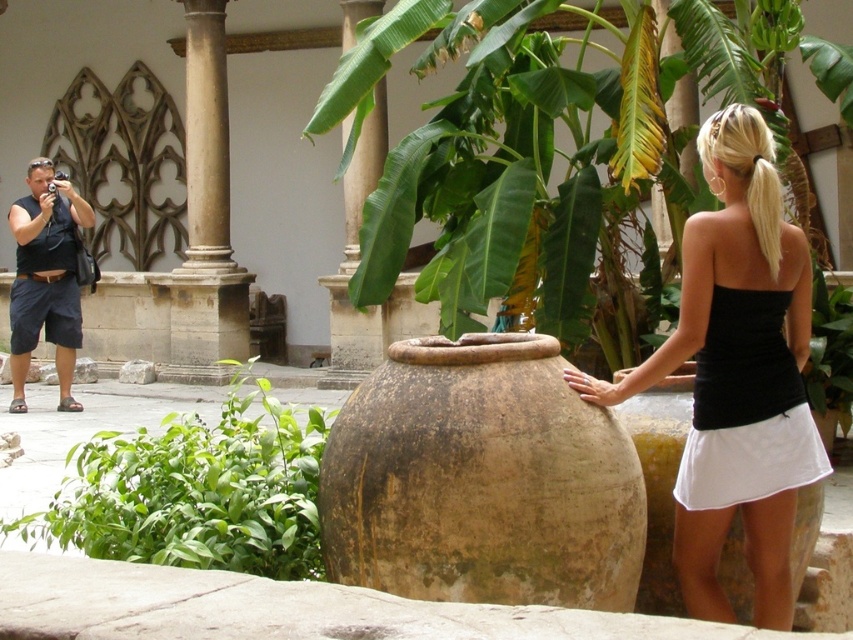
Is point (570, 512) more distant than point (315, 508)?

No.

Describe the element at coordinates (480, 481) in the screenshot. I see `brown earthenware vase at center` at that location.

Is point (322, 465) positioned before point (151, 531)?

That is True.

You are a GUI agent. You are given a task and a screenshot of the screen. Output one action in this format:
    pyautogui.click(x=<x>, y=<y>)
    Task: Click on the brown earthenware vase at center
    Image resolution: width=853 pixels, height=640 pixels.
    Given the screenshot: What is the action you would take?
    pyautogui.click(x=480, y=481)

Who is higher up, black matte tank top at center or green leafy plant at left?

Positioned higher is black matte tank top at center.

Can you confirm if black matte tank top at center is smaller than green leafy plant at left?

No, black matte tank top at center is not smaller than green leafy plant at left.

Image resolution: width=853 pixels, height=640 pixels. I want to click on black matte tank top at center, so click(737, 374).

Find the location of a particular element. black matte tank top at center is located at coordinates (737, 374).

Does brown earthenware vase at center have a larger size compared to black matte tank top at center?

No, brown earthenware vase at center is not bigger than black matte tank top at center.

Based on the photo, is brown earthenware vase at center to the right of black matte tank top at center from the viewer's perspective?

No, brown earthenware vase at center is not to the right of black matte tank top at center.

Is point (351, 566) closer to camera compared to point (762, 577)?

Yes.

This screenshot has width=853, height=640. In order to click on brown earthenware vase at center in this screenshot , I will do `click(480, 481)`.